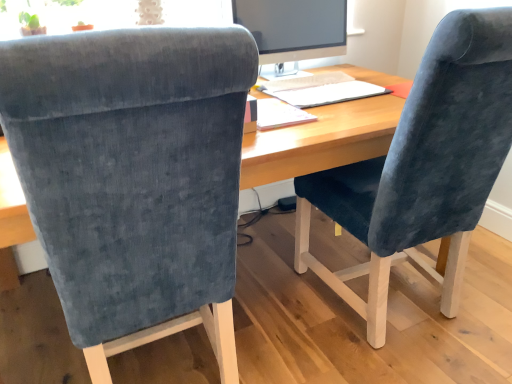
Question: From a real-world perspective, relative to velvet blue chair at center, which is counted as the 1th chair, starting from the left, is matte black monitor at upper center vertically above or below?

Choices:
 (A) above
 (B) below

Answer: (A)

Question: Is matte black monitor at upper center bigger or smaller than velvet blue chair at center, which is counted as the 1th chair, starting from the left?

Choices:
 (A) small
 (B) big

Answer: (A)

Question: Which of these objects is positioned farthest from the matte black monitor at upper center?

Choices:
 (A) wooden desk at center
 (B) velvet blue chair at center, the second chair viewed from the right
 (C) velvet blue chair at right, the 2th chair viewed from the left
 (D) white paper notepad at center

Answer: (B)

Question: Which object is the closest to the velvet blue chair at right, which is the first chair from right to left?

Choices:
 (A) matte black monitor at upper center
 (B) velvet blue chair at center, the second chair viewed from the right
 (C) wooden desk at center
 (D) white paper notepad at center

Answer: (C)